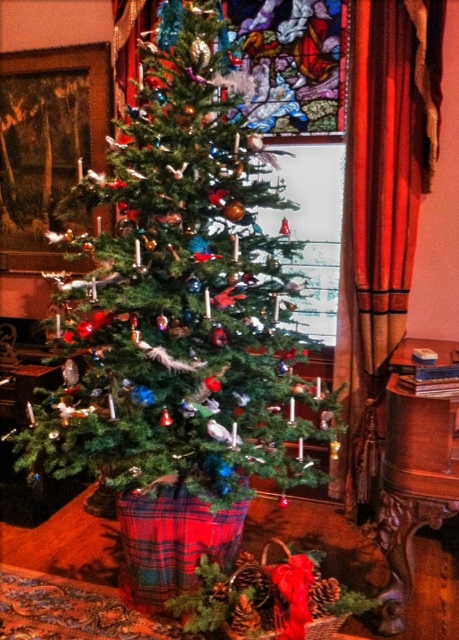
In the scene shown: Is green matte christmas tree at center smaller than shiny green tree at center?

Actually, green matte christmas tree at center might be larger than shiny green tree at center.

Which of these two, green matte christmas tree at center or shiny green tree at center, stands shorter?

shiny green tree at center

Does point (101, 385) come closer to viewer compared to point (22, 220)?

Yes, it is in front of point (22, 220).

Identify the location of green matte christmas tree at center. (183, 292).